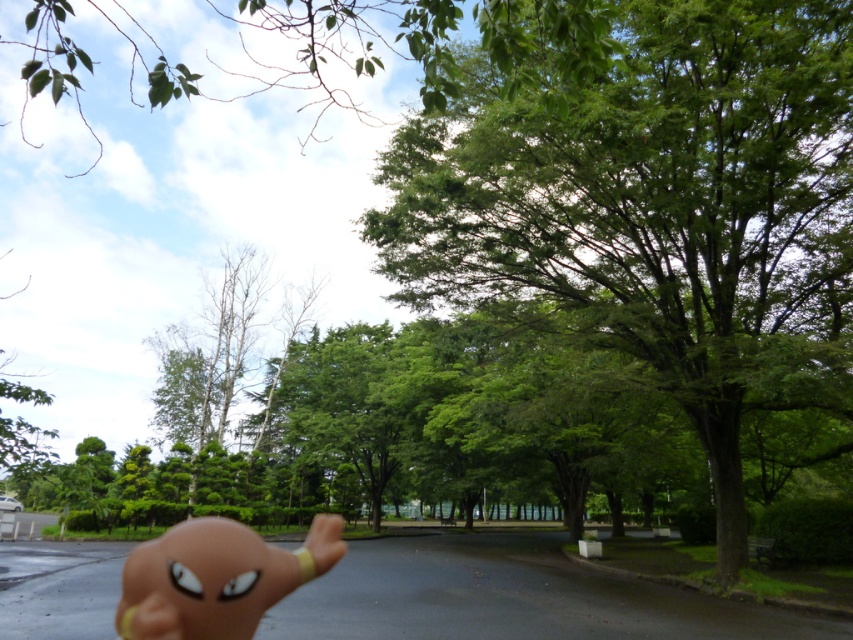
Question: Can you confirm if green leafy tree at center is positioned above matte plastic toy at lower center?

Choices:
 (A) yes
 (B) no

Answer: (A)

Question: Can you confirm if green leafy tree at center is positioned to the left of matte plastic toy at lower center?

Choices:
 (A) yes
 (B) no

Answer: (B)

Question: Can you confirm if green leafy tree at center is positioned below matte plastic toy at lower center?

Choices:
 (A) yes
 (B) no

Answer: (B)